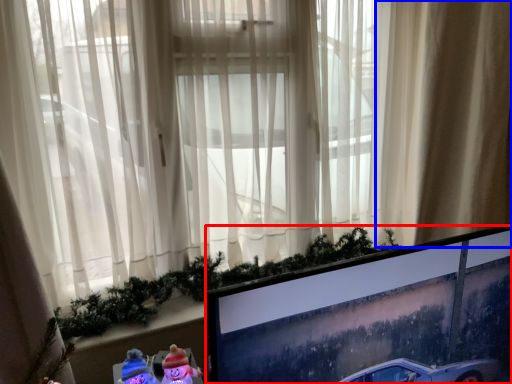
Question: Among these objects, which one is nearest to the camera, computer monitor (highlighted by a red box) or curtain (highlighted by a blue box)?

Choices:
 (A) computer monitor
 (B) curtain

Answer: (A)